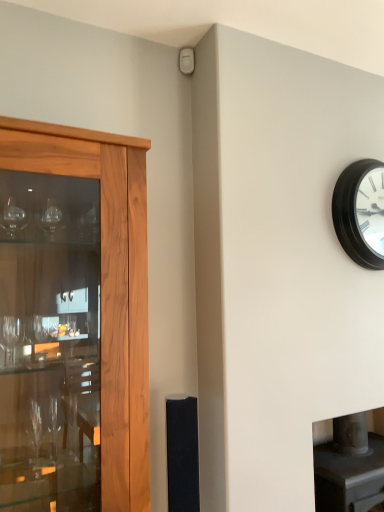
Question: Should I look upward or downward to see black matte clock at upper right?

Choices:
 (A) up
 (B) down

Answer: (A)

Question: Considering the relative sizes of wooden cabinet at left and black matte clock at upper right in the image provided, is wooden cabinet at left shorter than black matte clock at upper right?

Choices:
 (A) yes
 (B) no

Answer: (B)

Question: Is the depth of wooden cabinet at left less than that of black matte clock at upper right?

Choices:
 (A) no
 (B) yes

Answer: (B)

Question: Does wooden cabinet at left have a greater width compared to black matte clock at upper right?

Choices:
 (A) no
 (B) yes

Answer: (B)

Question: Is wooden cabinet at left not near black matte clock at upper right?

Choices:
 (A) yes
 (B) no

Answer: (A)

Question: From the image's perspective, would you say wooden cabinet at left is shown under black matte clock at upper right?

Choices:
 (A) no
 (B) yes

Answer: (B)

Question: Is wooden cabinet at left oriented towards black matte clock at upper right?

Choices:
 (A) yes
 (B) no

Answer: (B)

Question: Is wooden cabinet at left outside of black matte speaker at center?

Choices:
 (A) yes
 (B) no

Answer: (A)

Question: Is wooden cabinet at left bigger than black matte speaker at center?

Choices:
 (A) yes
 (B) no

Answer: (A)

Question: Is wooden cabinet at left oriented away from black matte speaker at center?

Choices:
 (A) no
 (B) yes

Answer: (A)

Question: Is wooden cabinet at left far away from black matte speaker at center?

Choices:
 (A) yes
 (B) no

Answer: (B)

Question: From the image's perspective, is wooden cabinet at left on top of black matte speaker at center?

Choices:
 (A) no
 (B) yes

Answer: (B)

Question: Considering the relative sizes of wooden cabinet at left and black matte speaker at center in the image provided, is wooden cabinet at left wider than black matte speaker at center?

Choices:
 (A) yes
 (B) no

Answer: (A)

Question: Can you confirm if black matte clock at upper right is smaller than wooden cabinet at left?

Choices:
 (A) no
 (B) yes

Answer: (B)